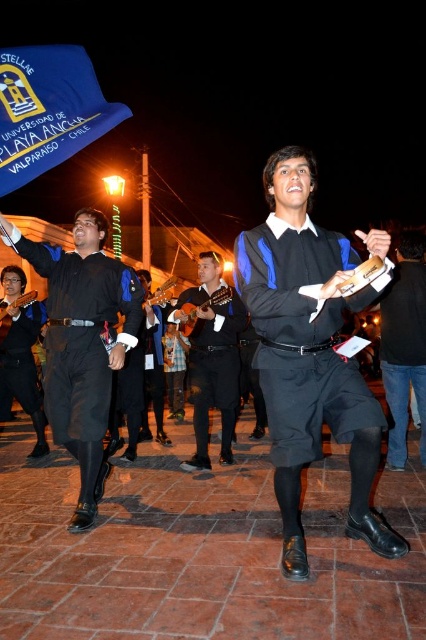
You are standing at the center of the scene and see the point marked at coordinates (308, 353). What object is located at that point?

The point at coordinates (308, 353) corresponds to the black matte shorts at center.

You are standing at the origin point in the image. There are two points marked in the scene, point (x=324, y=296) and point (x=77, y=385). Which point is closer to you?

Point (x=324, y=296) is in front of point (x=77, y=385), so it is closer to you.